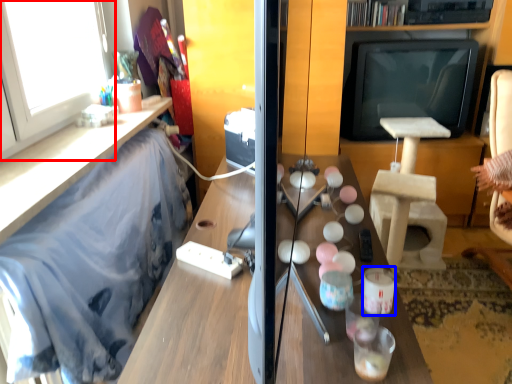
Question: Which of the following is the closest to the observer, window (highlighted by a red box) or candle holder (highlighted by a blue box)?

Choices:
 (A) window
 (B) candle holder

Answer: (B)